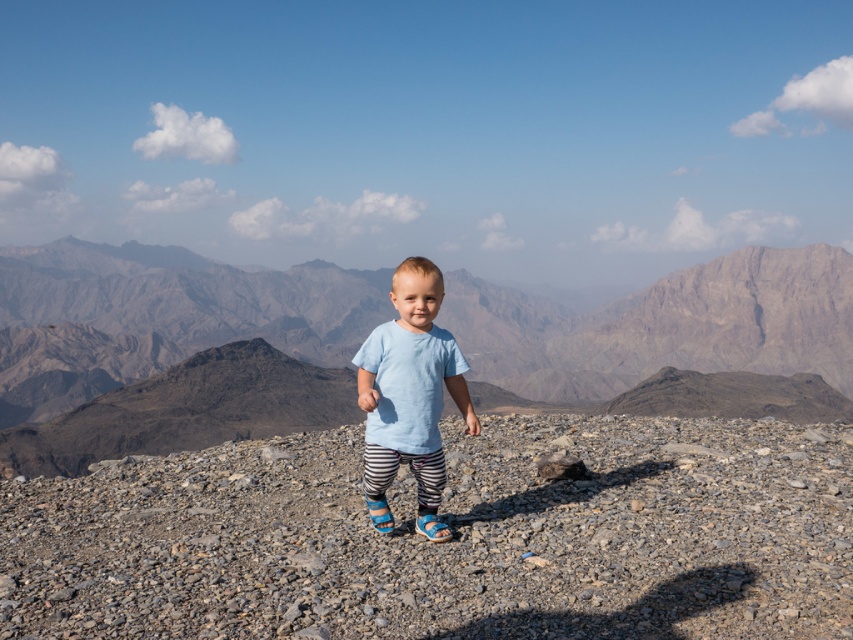
Question: Considering the relative positions of gray gravel at center and light blue cotton shirt at center in the image provided, where is gray gravel at center located with respect to light blue cotton shirt at center?

Choices:
 (A) left
 (B) right

Answer: (A)

Question: Which point is closer to the camera taking this photo?

Choices:
 (A) (405, 401)
 (B) (610, 604)

Answer: (B)

Question: Can you confirm if gray gravel at center is bigger than light blue cotton shirt at center?

Choices:
 (A) no
 (B) yes

Answer: (A)

Question: Can you confirm if gray gravel at center is positioned to the left of light blue cotton shirt at center?

Choices:
 (A) yes
 (B) no

Answer: (A)

Question: Which of the following is the closest to the observer?

Choices:
 (A) (534, 536)
 (B) (373, 397)

Answer: (B)